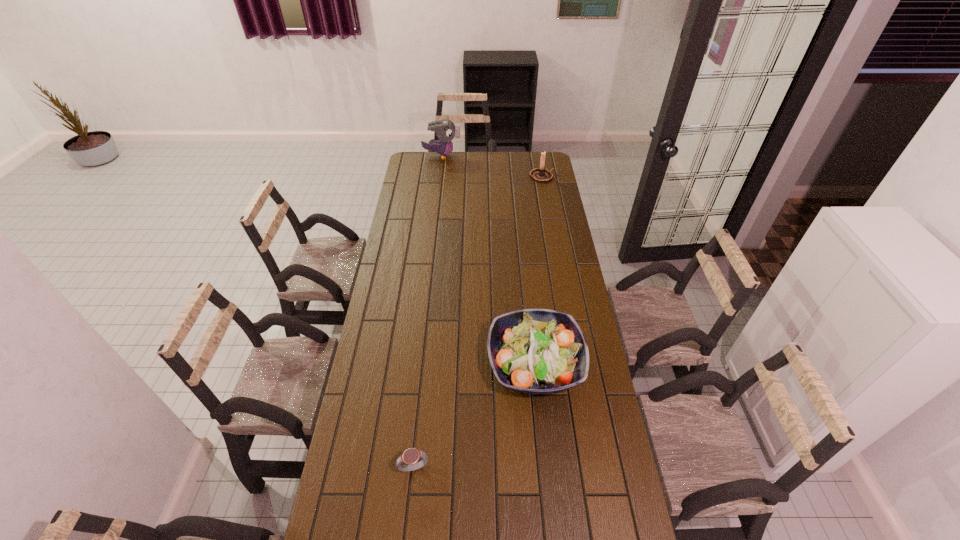
The width and height of the screenshot is (960, 540). What are the coordinates of `free space located on the left of the second shortest object` in the screenshot? It's located at (428, 364).

Find the location of a particular element. vacant space located on the right of the nearest object is located at coordinates (494, 467).

The image size is (960, 540). I want to click on bird located at the far edge, so click(446, 130).

Find the location of a particular element. The width and height of the screenshot is (960, 540). candle holder located in the far edge section of the desktop is located at coordinates (541, 174).

You are a GUI agent. You are given a task and a screenshot of the screen. Output one action in this format:
    pyautogui.click(x=<x>, y=<y>)
    Task: Click on the object present at the left edge
    This screenshot has width=960, height=540.
    Given the screenshot: What is the action you would take?
    pos(446,130)

I want to click on candle holder that is at the right edge, so click(x=541, y=174).

What are the coordinates of `salad plate that is at the right edge` in the screenshot? It's located at (538, 351).

Where is `object located in the far left corner section of the desktop`? object located in the far left corner section of the desktop is located at coordinates (446, 130).

I want to click on object at the far right corner, so click(541, 174).

The height and width of the screenshot is (540, 960). In the image, there is a desktop. Identify the location of blank space at the far edge. (489, 171).